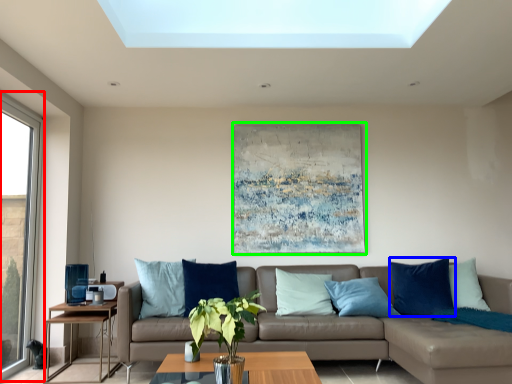
Question: Estimate the real-world distances between objects in this image. Which object is closer to window (highlighted by a red box), pillow (highlighted by a blue box) or picture frame (highlighted by a green box)?

Choices:
 (A) pillow
 (B) picture frame

Answer: (B)